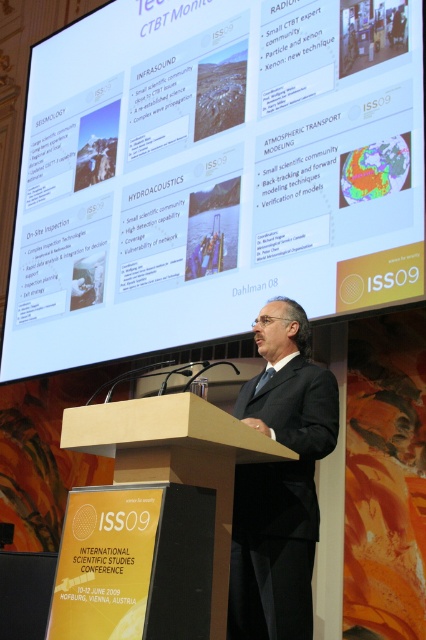
Question: Which of the following is the farthest from the observer?

Choices:
 (A) (287, 538)
 (B) (405, 67)

Answer: (B)

Question: Considering the real-world distances, which object is closest to the black suit at center?

Choices:
 (A) brown wood podium at center
 (B) white glossy projection screen at upper center

Answer: (A)

Question: Does white glossy projection screen at upper center appear under brown wood podium at center?

Choices:
 (A) yes
 (B) no

Answer: (B)

Question: Which of the following is the farthest from the observer?

Choices:
 (A) brown wood podium at center
 (B) black suit at center
 (C) white glossy projection screen at upper center

Answer: (C)

Question: Considering the relative positions of black suit at center and brown wood podium at center in the image provided, where is black suit at center located with respect to brown wood podium at center?

Choices:
 (A) right
 (B) left

Answer: (A)

Question: Can you confirm if white glossy projection screen at upper center is thinner than brown wood podium at center?

Choices:
 (A) no
 (B) yes

Answer: (A)